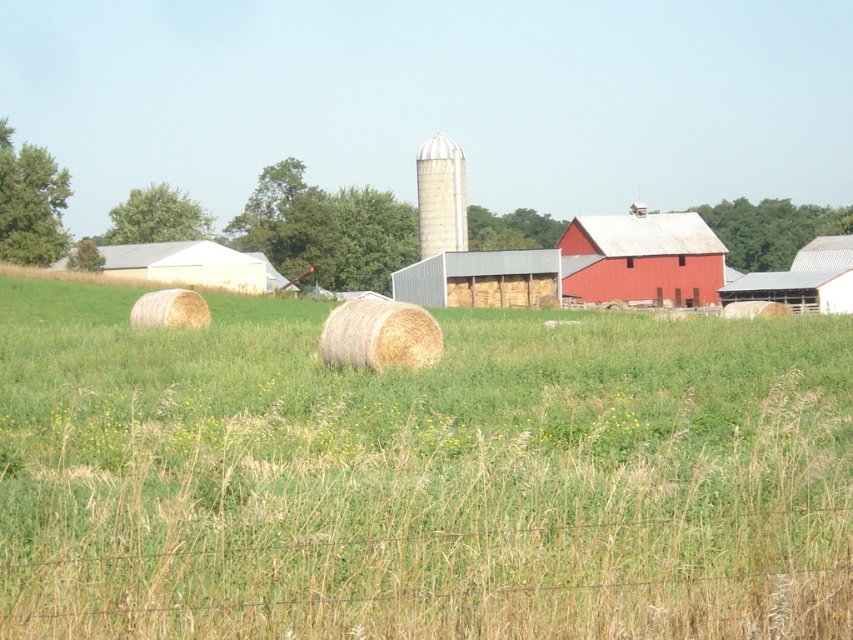
Question: Is matte red barn at center behind metallic gray barn at center?

Choices:
 (A) no
 (B) yes

Answer: (B)

Question: Is metallic gray barn at center positioned at the back of light brown straw bale at center?

Choices:
 (A) no
 (B) yes

Answer: (B)

Question: Which object is positioned closest to the golden straw bale at center?

Choices:
 (A) white matte barn at left
 (B) matte red barn at center
 (C) light brown straw bale at center
 (D) beige straw bale at center

Answer: (D)

Question: Does green grassy at center appear under white matte barn at left?

Choices:
 (A) no
 (B) yes

Answer: (B)

Question: Based on their relative distances, which object is nearer to the metallic gray barn at center?

Choices:
 (A) golden straw bale at center
 (B) beige straw bale at center
 (C) matte red barn at center
 (D) light brown straw bale at center

Answer: (C)

Question: Which point is farther to the camera?

Choices:
 (A) green grassy at center
 (B) light brown straw bale at center
 (C) white textured silo at center
 (D) golden straw bale at center

Answer: (C)